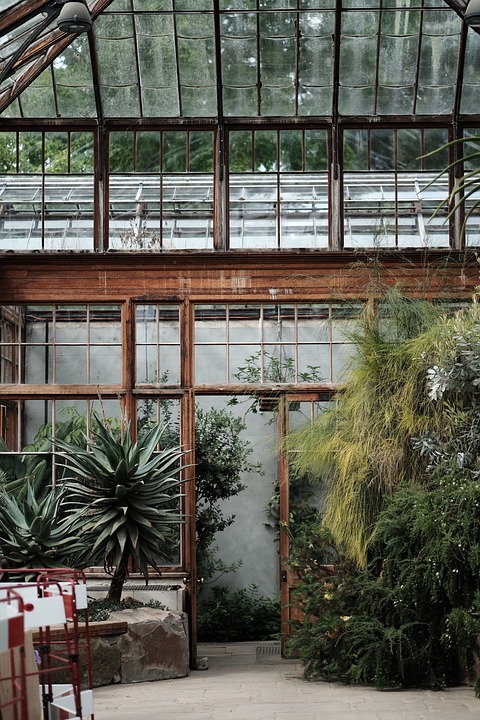
The height and width of the screenshot is (720, 480). In order to click on open door in this screenshot , I will do `click(192, 531)`, `click(193, 603)`.